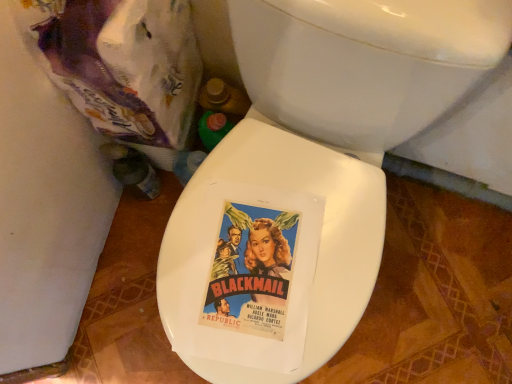
Question: Is white glossy toilet seat at center oriented towards purple plastic bag at upper left?

Choices:
 (A) yes
 (B) no

Answer: (B)

Question: Considering the relative sizes of white glossy toilet seat at center and purple plastic bag at upper left in the image provided, is white glossy toilet seat at center shorter than purple plastic bag at upper left?

Choices:
 (A) no
 (B) yes

Answer: (A)

Question: Is white glossy toilet seat at center with purple plastic bag at upper left?

Choices:
 (A) yes
 (B) no

Answer: (B)

Question: Considering the relative sizes of white glossy toilet seat at center and purple plastic bag at upper left in the image provided, is white glossy toilet seat at center bigger than purple plastic bag at upper left?

Choices:
 (A) no
 (B) yes

Answer: (B)

Question: Considering the relative positions of white glossy toilet seat at center and purple plastic bag at upper left in the image provided, is white glossy toilet seat at center behind purple plastic bag at upper left?

Choices:
 (A) yes
 (B) no

Answer: (B)

Question: Is white glossy toilet seat at center to the right of purple plastic bag at upper left from the viewer's perspective?

Choices:
 (A) yes
 (B) no

Answer: (A)

Question: Does purple plastic bag at upper left have a lesser width compared to white glossy toilet seat at center?

Choices:
 (A) no
 (B) yes

Answer: (B)

Question: Is purple plastic bag at upper left bigger than white glossy toilet seat at center?

Choices:
 (A) yes
 (B) no

Answer: (B)

Question: Could you tell me if purple plastic bag at upper left is facing white glossy toilet seat at center?

Choices:
 (A) no
 (B) yes

Answer: (A)

Question: From a real-world perspective, does purple plastic bag at upper left stand above white glossy toilet seat at center?

Choices:
 (A) yes
 (B) no

Answer: (A)

Question: Would you say white glossy toilet seat at center is part of purple plastic bag at upper left's contents?

Choices:
 (A) yes
 (B) no

Answer: (B)

Question: Is purple plastic bag at upper left outside of white glossy toilet seat at center?

Choices:
 (A) yes
 (B) no

Answer: (A)

Question: Looking at their shapes, would you say white glossy toilet seat at center is wider or thinner than purple plastic bag at upper left?

Choices:
 (A) thin
 (B) wide

Answer: (B)